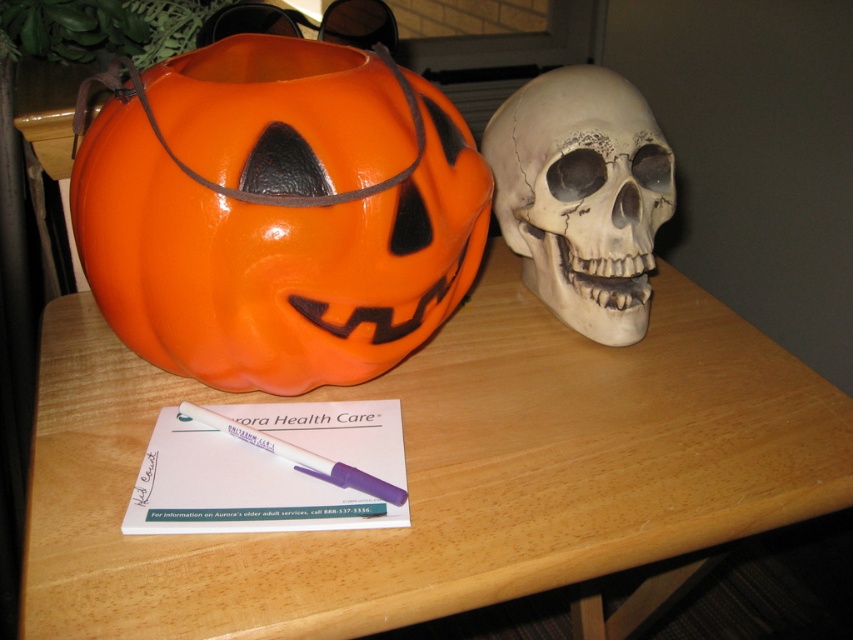
Question: Among these points, which one is nearest to the camera?

Choices:
 (A) (384, 118)
 (B) (321, 456)

Answer: (A)

Question: Does wooden table at center have a lesser width compared to purple plastic pen at center?

Choices:
 (A) yes
 (B) no

Answer: (B)

Question: Estimate the real-world distances between objects in this image. Which object is closer to the purple plastic pen at center?

Choices:
 (A) wooden table at center
 (B) glossy plastic pumpkin at left

Answer: (A)

Question: Where is wooden table at center located in relation to glossy plastic pumpkin at left in the image?

Choices:
 (A) right
 (B) left

Answer: (A)

Question: Which object is closer to the camera taking this photo?

Choices:
 (A) white matte skull at right
 (B) purple plastic pen at center
 (C) wooden table at center
 (D) glossy plastic pumpkin at left

Answer: (C)

Question: Can you confirm if wooden table at center is bigger than glossy plastic pumpkin at left?

Choices:
 (A) yes
 (B) no

Answer: (A)